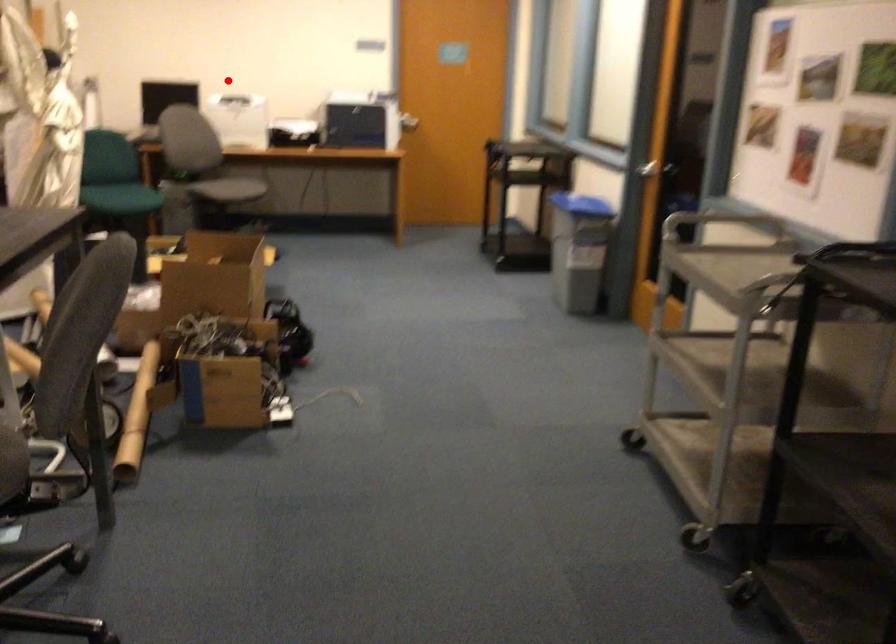
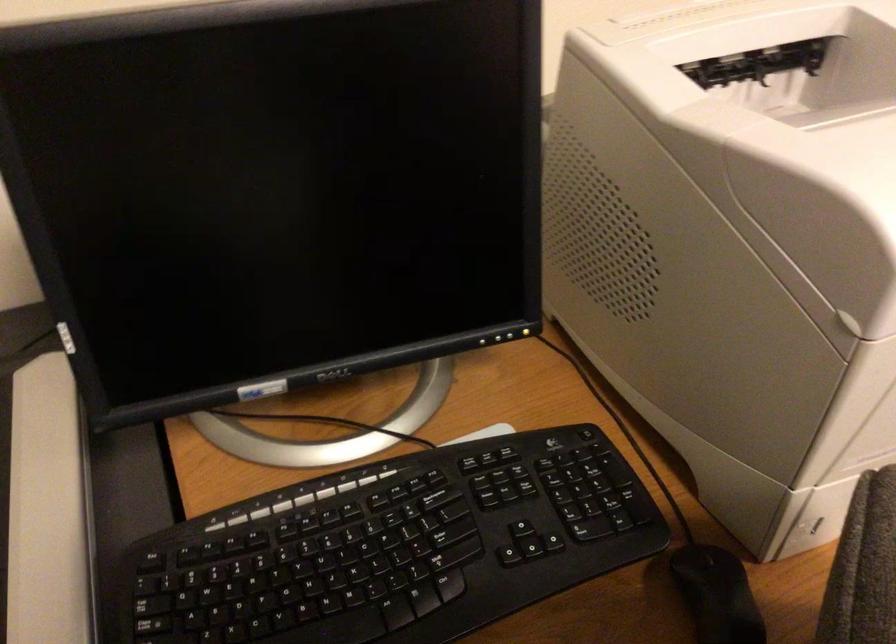
Question: I am providing you with two images of the same scene from different viewpoints. Given a red point in image1, look at the same physical point in image2. Is it:

Choices:
 (A) Closer to the viewpoint
 (B) Farther from the viewpoint

Answer: (A)